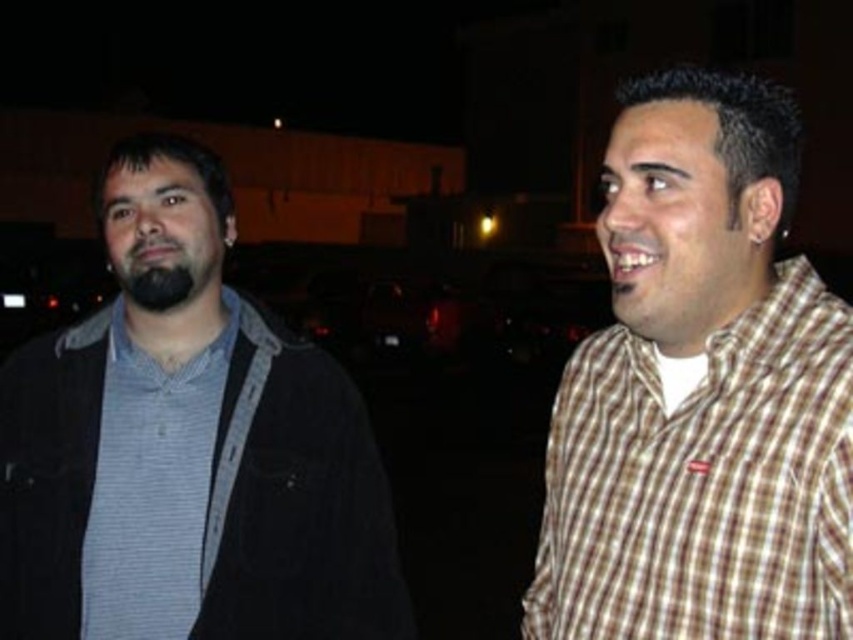
Measure the distance between brown checkered shirt at right and gray striped shirt at left.

A distance of 87.79 centimeters exists between brown checkered shirt at right and gray striped shirt at left.

Is brown checkered shirt at right further to camera compared to gray striped shirt at left?

That is False.

Is point (618, 406) closer to viewer compared to point (158, 524)?

Yes.

Where is `brown checkered shirt at right`? brown checkered shirt at right is located at coordinates (704, 483).

Who is more distant from viewer, (335,403) or (706,464)?

Positioned behind is point (335,403).

Is point (195, 356) in front of point (575, 493)?

No, (195, 356) is further to viewer.

What are the coordinates of `matte black jacket at left` in the screenshot? It's located at (186, 448).

Looking at this image, who is positioned more to the left, matte black jacket at left or gray striped shirt at left?

From the viewer's perspective, matte black jacket at left appears more on the left side.

Is matte black jacket at left further to the viewer compared to gray striped shirt at left?

No, it is in front of gray striped shirt at left.

Find the location of a particular element. The width and height of the screenshot is (853, 640). matte black jacket at left is located at coordinates (186, 448).